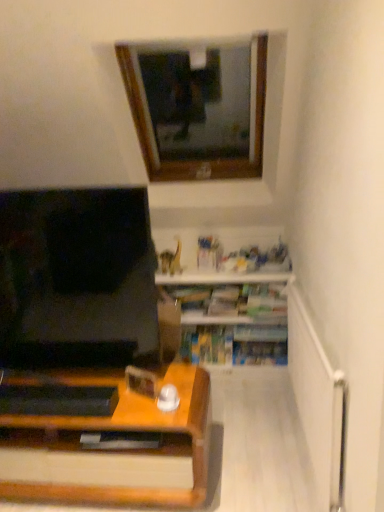
Question: In terms of size, does wooden frame at upper center appear bigger or smaller than white glossy shelf at lower center?

Choices:
 (A) small
 (B) big

Answer: (B)

Question: In terms of height, does wooden frame at upper center look taller or shorter compared to white glossy shelf at lower center?

Choices:
 (A) tall
 (B) short

Answer: (A)

Question: Visually, is wooden frame at upper center positioned to the left or to the right of white glossy shelf at lower center?

Choices:
 (A) right
 (B) left

Answer: (B)

Question: Is point (223, 325) positioned closer to the camera than point (193, 67)?

Choices:
 (A) closer
 (B) farther

Answer: (A)

Question: From their relative heights in the image, would you say white glossy shelf at lower center is taller or shorter than wooden frame at upper center?

Choices:
 (A) tall
 (B) short

Answer: (B)

Question: From a real-world perspective, is white glossy shelf at lower center positioned above or below wooden frame at upper center?

Choices:
 (A) above
 (B) below

Answer: (B)

Question: Considering the positions of white glossy shelf at lower center and wooden frame at upper center in the image, is white glossy shelf at lower center bigger or smaller than wooden frame at upper center?

Choices:
 (A) big
 (B) small

Answer: (B)